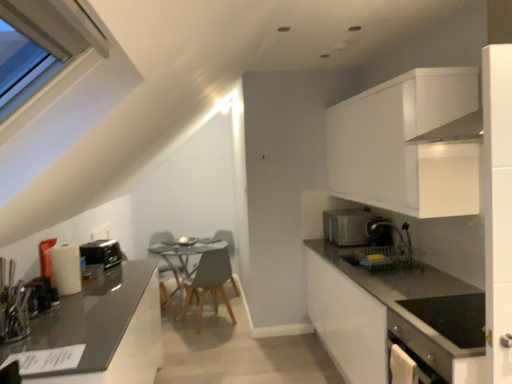
Question: From a real-world perspective, is black plastic toaster at left, which is counted as the 2th appliance, starting from the front, on top of wooden chair at center?

Choices:
 (A) no
 (B) yes

Answer: (B)

Question: Does black plastic toaster at left, which is counted as the 2th appliance, starting from the front, have a larger size compared to wooden chair at center?

Choices:
 (A) yes
 (B) no

Answer: (B)

Question: Is black plastic toaster at left, which is counted as the first appliance, starting from the back, surrounding wooden chair at center?

Choices:
 (A) no
 (B) yes

Answer: (A)

Question: Is black plastic toaster at left, which is counted as the first appliance, starting from the back, at the right side of wooden chair at center?

Choices:
 (A) no
 (B) yes

Answer: (A)

Question: Is the depth of black plastic toaster at left, which is counted as the first appliance, starting from the back, greater than that of wooden chair at center?

Choices:
 (A) no
 (B) yes

Answer: (A)

Question: Is black plastic toaster at left, which is counted as the first appliance, starting from the back, closer to camera compared to wooden chair at center?

Choices:
 (A) yes
 (B) no

Answer: (A)

Question: Considering the relative sizes of matte gray countertop at right, marked as the 1th countertop in a right-to-left arrangement, and satin black coffee machine at right in the image provided, is matte gray countertop at right, marked as the 1th countertop in a right-to-left arrangement, wider than satin black coffee machine at right?

Choices:
 (A) yes
 (B) no

Answer: (A)

Question: Is matte gray countertop at right, marked as the 1th countertop in a right-to-left arrangement, facing towards satin black coffee machine at right?

Choices:
 (A) yes
 (B) no

Answer: (B)

Question: Can you confirm if matte gray countertop at right, which is the 2th countertop from left to right, is smaller than satin black coffee machine at right?

Choices:
 (A) yes
 (B) no

Answer: (B)

Question: Is matte gray countertop at right, marked as the 1th countertop in a right-to-left arrangement, located outside satin black coffee machine at right?

Choices:
 (A) yes
 (B) no

Answer: (A)

Question: Is matte gray countertop at right, marked as the 1th countertop in a right-to-left arrangement, looking in the opposite direction of satin black coffee machine at right?

Choices:
 (A) no
 (B) yes

Answer: (A)

Question: Considering the relative sizes of matte gray countertop at right, which is the 2th countertop from left to right, and satin black coffee machine at right in the image provided, is matte gray countertop at right, which is the 2th countertop from left to right, shorter than satin black coffee machine at right?

Choices:
 (A) yes
 (B) no

Answer: (B)

Question: Considering the relative sizes of shiny dark gray countertop at left, which ranks as the first countertop in left-to-right order, and wooden chair at center in the image provided, is shiny dark gray countertop at left, which ranks as the first countertop in left-to-right order, shorter than wooden chair at center?

Choices:
 (A) no
 (B) yes

Answer: (A)